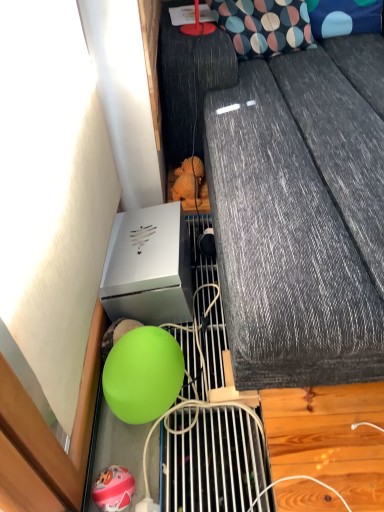
The height and width of the screenshot is (512, 384). What do you see at coordinates (290, 202) in the screenshot? I see `green rubber ball at lower left` at bounding box center [290, 202].

This screenshot has height=512, width=384. Describe the element at coordinates (344, 17) in the screenshot. I see `blue dotted fabric pillow at upper right, the first pillow when ordered from right to left` at that location.

What do you see at coordinates (264, 26) in the screenshot?
I see `polka dot fabric pillow at upper center, the 2th pillow in the right-to-left sequence` at bounding box center [264, 26].

This screenshot has width=384, height=512. I want to click on green matte ball at lower center, so click(x=143, y=375).

Can you tell me how much green rubber ball at lower left and polka dot fabric pillow at upper center, positioned as the 1th pillow in left-to-right order, differ in facing direction?

The facing directions of green rubber ball at lower left and polka dot fabric pillow at upper center, positioned as the 1th pillow in left-to-right order, are 14.1 degrees apart.

Does green rubber ball at lower left have a greater width compared to polka dot fabric pillow at upper center, positioned as the 1th pillow in left-to-right order?

Yes.

Is green rubber ball at lower left facing towards polka dot fabric pillow at upper center, positioned as the 1th pillow in left-to-right order?

No.

From the image's perspective, is green rubber ball at lower left over polka dot fabric pillow at upper center, the 2th pillow in the right-to-left sequence?

No, from the image's perspective, green rubber ball at lower left is not over polka dot fabric pillow at upper center, the 2th pillow in the right-to-left sequence.

Is green matte ball at lower center oriented away from green rubber ball at lower left?

No.

Who is more distant, green matte ball at lower center or green rubber ball at lower left?

green matte ball at lower center is behind.

In the image, there is a green rubber ball at lower left. Identify the location of ball below it (from a real-world perspective). (143, 375).

Considering the positions of objects green matte ball at lower center and green rubber ball at lower left in the image provided, who is more to the left, green matte ball at lower center or green rubber ball at lower left?

green matte ball at lower center.

From a real-world perspective, who is located lower, blue dotted fabric pillow at upper right, the 2th pillow when ordered from left to right, or polka dot fabric pillow at upper center, the 2th pillow in the right-to-left sequence?

blue dotted fabric pillow at upper right, the 2th pillow when ordered from left to right.

Is blue dotted fabric pillow at upper right, the first pillow when ordered from right to left, shorter than polka dot fabric pillow at upper center, positioned as the 1th pillow in left-to-right order?

Yes, blue dotted fabric pillow at upper right, the first pillow when ordered from right to left, is shorter than polka dot fabric pillow at upper center, positioned as the 1th pillow in left-to-right order.

Considering the positions of objects blue dotted fabric pillow at upper right, the 2th pillow when ordered from left to right, and polka dot fabric pillow at upper center, the 2th pillow in the right-to-left sequence, in the image provided, who is in front, blue dotted fabric pillow at upper right, the 2th pillow when ordered from left to right, or polka dot fabric pillow at upper center, the 2th pillow in the right-to-left sequence,?

polka dot fabric pillow at upper center, the 2th pillow in the right-to-left sequence, is more forward.

Is blue dotted fabric pillow at upper right, the 2th pillow when ordered from left to right, positioned with its back to polka dot fabric pillow at upper center, the 2th pillow in the right-to-left sequence?

No, blue dotted fabric pillow at upper right, the 2th pillow when ordered from left to right, is not facing the opposite direction of polka dot fabric pillow at upper center, the 2th pillow in the right-to-left sequence.

Find the location of `furniture lying in front of the blue dotted fabric pillow at upper right, the first pillow when ordered from right to left`. furniture lying in front of the blue dotted fabric pillow at upper right, the first pillow when ordered from right to left is located at coordinates (290, 202).

Is green rubber ball at lower left at the right side of blue dotted fabric pillow at upper right, the first pillow when ordered from right to left?

No.

Who is taller, green rubber ball at lower left or blue dotted fabric pillow at upper right, the 2th pillow when ordered from left to right?

Standing taller between the two is green rubber ball at lower left.

How far apart are green rubber ball at lower left and blue dotted fabric pillow at upper right, the first pillow when ordered from right to left?

The distance of green rubber ball at lower left from blue dotted fabric pillow at upper right, the first pillow when ordered from right to left, is 81.58 centimeters.

Is polka dot fabric pillow at upper center, the 2th pillow in the right-to-left sequence, in front of or behind matte green balloon at lower left in the image?

In the image, polka dot fabric pillow at upper center, the 2th pillow in the right-to-left sequence, appears behind matte green balloon at lower left.

Does point (260, 56) come farther from viewer compared to point (113, 467)?

Yes.

Considering the relative sizes of polka dot fabric pillow at upper center, positioned as the 1th pillow in left-to-right order, and matte green balloon at lower left in the image provided, is polka dot fabric pillow at upper center, positioned as the 1th pillow in left-to-right order, wider than matte green balloon at lower left?

Correct, the width of polka dot fabric pillow at upper center, positioned as the 1th pillow in left-to-right order, exceeds that of matte green balloon at lower left.

Can you tell me how much green rubber ball at lower left and green matte ball at lower center differ in facing direction?

The angular difference between green rubber ball at lower left and green matte ball at lower center is 89.1 degrees.

From a real-world perspective, who is located higher, green rubber ball at lower left or green matte ball at lower center?

In real-world perspective, green rubber ball at lower left is above.

Consider the image. Considering the sizes of objects green rubber ball at lower left and green matte ball at lower center in the image provided, who is taller, green rubber ball at lower left or green matte ball at lower center?

green rubber ball at lower left.

Is green rubber ball at lower left wider than green matte ball at lower center?

Yes.

Between matte green balloon at lower left and polka dot fabric pillow at upper center, the 2th pillow in the right-to-left sequence, which one has larger size?

polka dot fabric pillow at upper center, the 2th pillow in the right-to-left sequence.

Is matte green balloon at lower left placed right next to polka dot fabric pillow at upper center, the 2th pillow in the right-to-left sequence?

matte green balloon at lower left and polka dot fabric pillow at upper center, the 2th pillow in the right-to-left sequence, are clearly separated.

At what (x,y) coordinates should I click in order to perform the action: click on balloon that appears on the left of polka dot fabric pillow at upper center, the 2th pillow in the right-to-left sequence. Please return your answer as a coordinate pair (x, y). The width and height of the screenshot is (384, 512). Looking at the image, I should click on (113, 489).

Considering the relative positions of matte green balloon at lower left and polka dot fabric pillow at upper center, the 2th pillow in the right-to-left sequence, in the image provided, is matte green balloon at lower left in front of polka dot fabric pillow at upper center, the 2th pillow in the right-to-left sequence,?

Yes, matte green balloon at lower left is closer to the camera.

Locate an element on the screen. furniture below the polka dot fabric pillow at upper center, the 2th pillow in the right-to-left sequence (from a real-world perspective) is located at coordinates (290, 202).

Where is `furniture in front of the green matte ball at lower center`? The width and height of the screenshot is (384, 512). furniture in front of the green matte ball at lower center is located at coordinates (290, 202).

When comparing their distances from matte green balloon at lower left, does blue dotted fabric pillow at upper right, the first pillow when ordered from right to left, or green matte ball at lower center seem closer?

green matte ball at lower center is closer to matte green balloon at lower left.

Based on their spatial positions, is matte green balloon at lower left or green rubber ball at lower left further from blue dotted fabric pillow at upper right, the 2th pillow when ordered from left to right?

Among the two, matte green balloon at lower left is located further to blue dotted fabric pillow at upper right, the 2th pillow when ordered from left to right.

From the image, which object appears to be nearer to matte green balloon at lower left, polka dot fabric pillow at upper center, positioned as the 1th pillow in left-to-right order, or blue dotted fabric pillow at upper right, the first pillow when ordered from right to left?

Among the two, polka dot fabric pillow at upper center, positioned as the 1th pillow in left-to-right order, is located nearer to matte green balloon at lower left.

Which object lies nearer to the anchor point green matte ball at lower center, polka dot fabric pillow at upper center, the 2th pillow in the right-to-left sequence, or green rubber ball at lower left?

green rubber ball at lower left is closer to green matte ball at lower center.

When comparing their distances from green matte ball at lower center, does green rubber ball at lower left or matte green balloon at lower left seem closer?

The object closer to green matte ball at lower center is matte green balloon at lower left.

Based on their spatial positions, is green rubber ball at lower left or blue dotted fabric pillow at upper right, the 2th pillow when ordered from left to right, closer to green matte ball at lower center?

green rubber ball at lower left is positioned closer to the anchor green matte ball at lower center.

Estimate the real-world distances between objects in this image. Which object is closer to blue dotted fabric pillow at upper right, the first pillow when ordered from right to left, green matte ball at lower center or matte green balloon at lower left?

green matte ball at lower center.

Looking at the image, which one is located further to blue dotted fabric pillow at upper right, the 2th pillow when ordered from left to right, polka dot fabric pillow at upper center, the 2th pillow in the right-to-left sequence, or matte green balloon at lower left?

Among the two, matte green balloon at lower left is located further to blue dotted fabric pillow at upper right, the 2th pillow when ordered from left to right.

The width and height of the screenshot is (384, 512). I want to click on ball between green rubber ball at lower left and matte green balloon at lower left vertically, so click(x=143, y=375).

Image resolution: width=384 pixels, height=512 pixels. Identify the location of pillow between blue dotted fabric pillow at upper right, the first pillow when ordered from right to left, and green matte ball at lower center in the up-down direction. (264, 26).

I want to click on ball between polka dot fabric pillow at upper center, positioned as the 1th pillow in left-to-right order, and matte green balloon at lower left from top to bottom, so [143, 375].

Locate an element on the screen. The image size is (384, 512). pillow between blue dotted fabric pillow at upper right, the 2th pillow when ordered from left to right, and matte green balloon at lower left in the up-down direction is located at coordinates (264, 26).